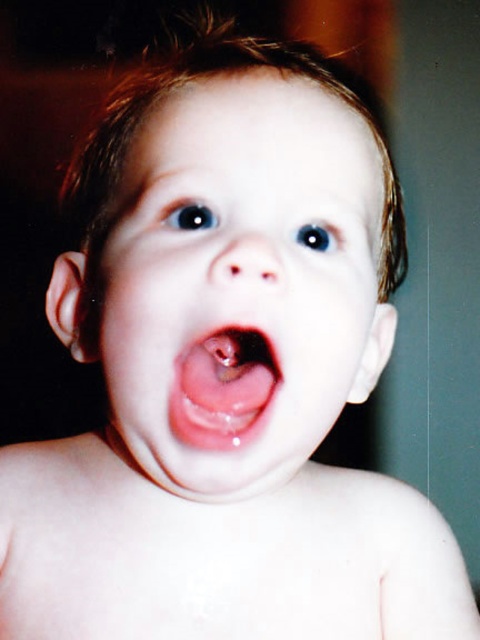
Question: Is smooth skin face at center thinner than pink glossy tongue at center?

Choices:
 (A) no
 (B) yes

Answer: (A)

Question: Which object is closer to the camera taking this photo?

Choices:
 (A) pink glossy tongue at center
 (B) smooth skin face at center

Answer: (B)

Question: Among these points, which one is nearest to the camera?

Choices:
 (A) (251, 394)
 (B) (276, 93)

Answer: (A)

Question: In this image, where is smooth skin face at center located relative to pink glossy tongue at center?

Choices:
 (A) above
 (B) below

Answer: (A)

Question: Is smooth skin face at center below pink glossy tongue at center?

Choices:
 (A) yes
 (B) no

Answer: (B)